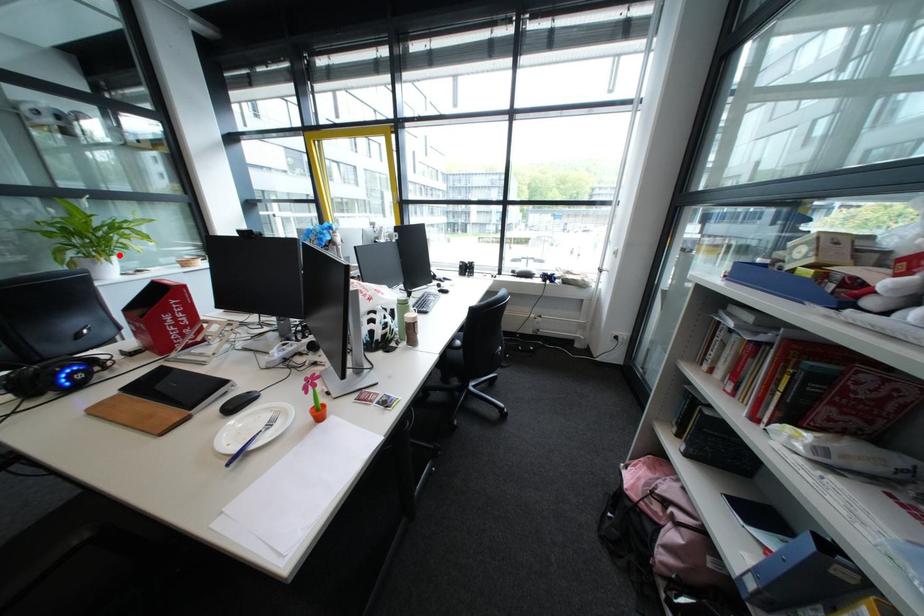
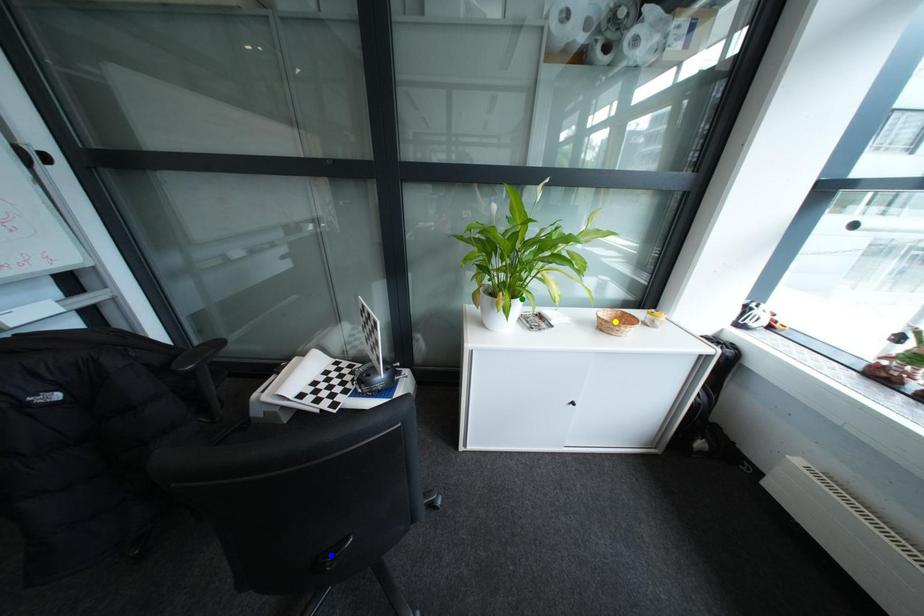
Question: I am providing you with two images of the same scene from different viewpoints. A red point is marked on the first image. You are given multiple points on the second image. Which point in image 2 is actually the same real-world point as the red point in image 1?

Choices:
 (A) yellow point
 (B) blue point
 (C) green point

Answer: (C)